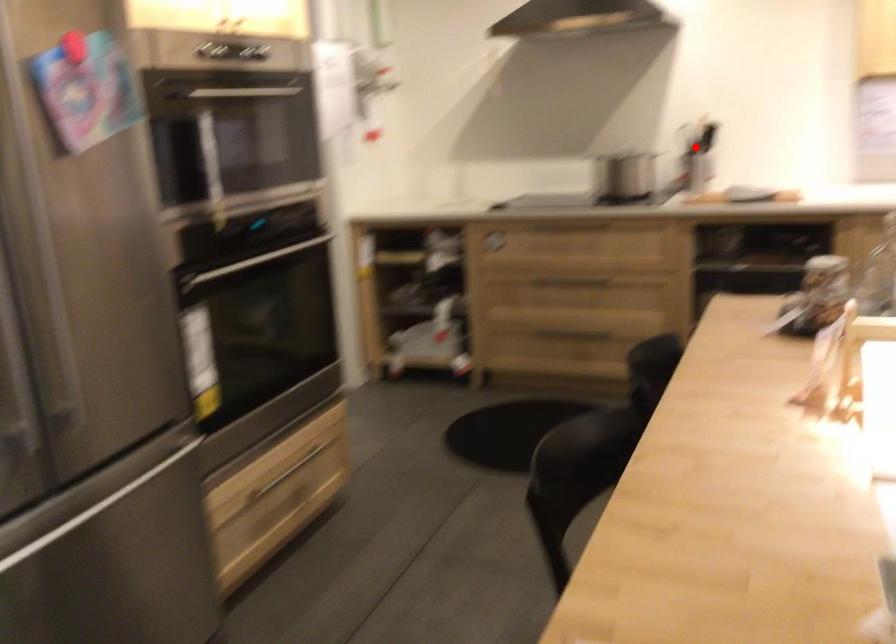
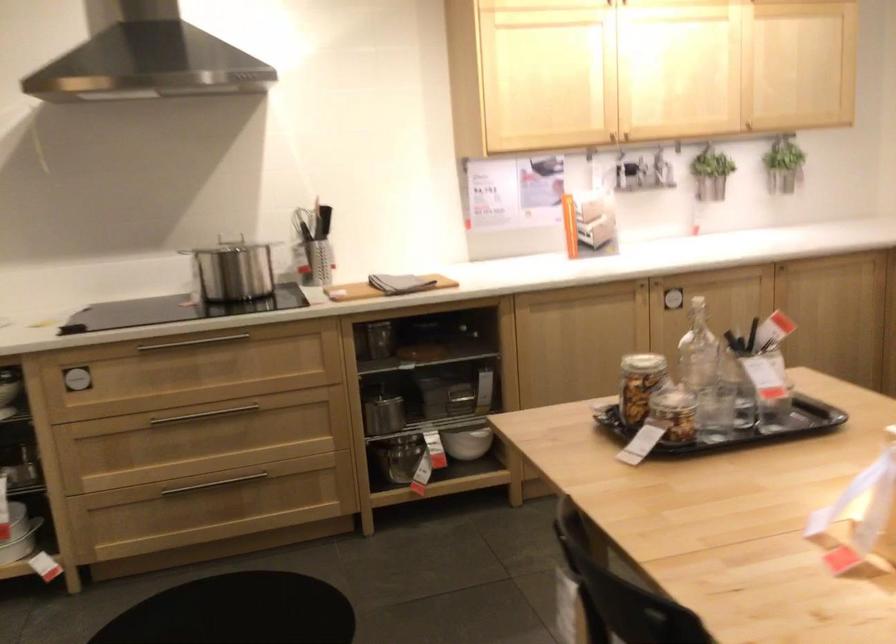
Question: I am providing you with two images of the same scene from different viewpoints. In image1, a red point is highlighted. Considering the same 3D point in image2, which of the following is correct?

Choices:
 (A) It is closer
 (B) It is farther

Answer: (A)